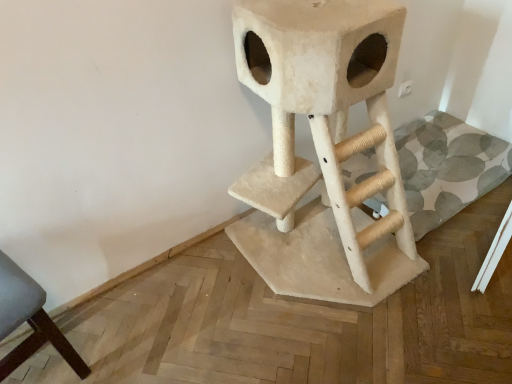
The image size is (512, 384). What are the coordinates of `vacant area situated below dark gray fabric chair at lower left (from a real-world perspective)` in the screenshot? It's located at (47, 366).